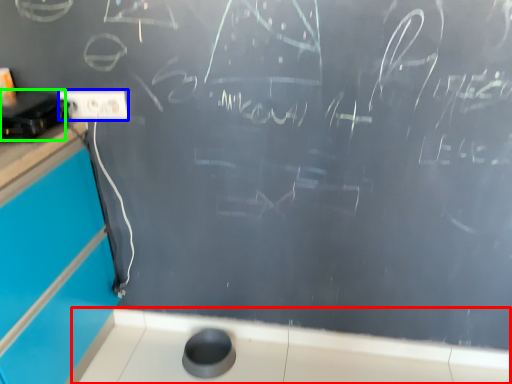
Question: Which object is the closest to the counter top (highlighted by a red box)? Choose among these: electric outlet (highlighted by a blue box) or appliance (highlighted by a green box).

Choices:
 (A) electric outlet
 (B) appliance

Answer: (A)